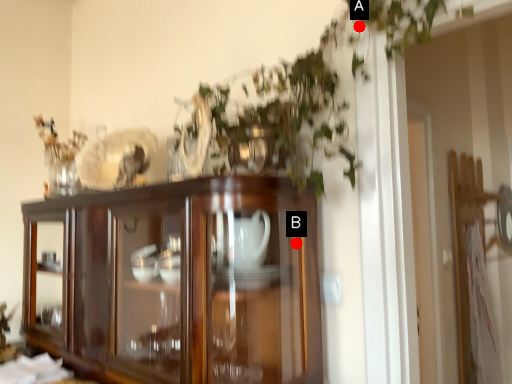
Question: Two points are circled on the image, labeled by A and B beside each circle. Which point is closer to the camera taking this photo?

Choices:
 (A) A is closer
 (B) B is closer

Answer: (B)